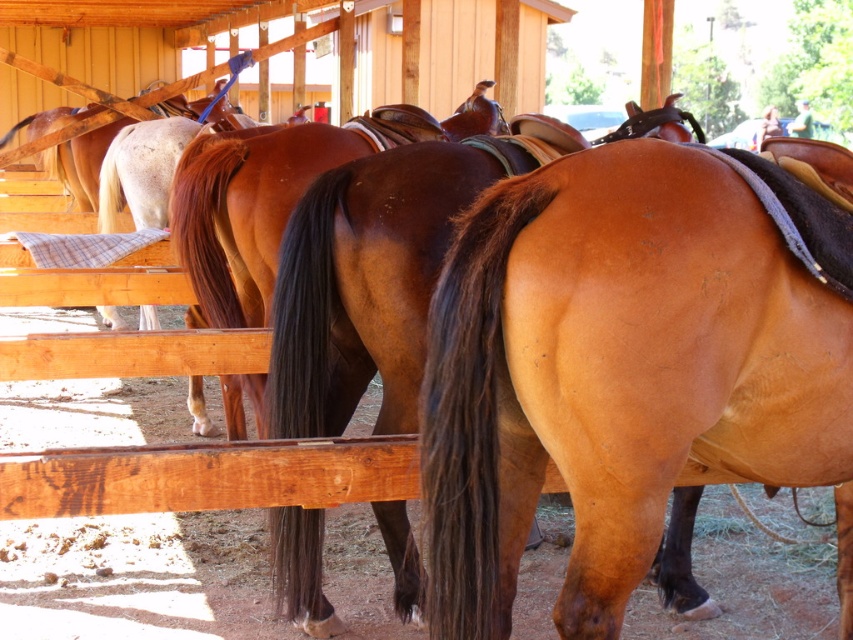
Question: Is shiny brown horse at center further to the viewer compared to brown glossy horse at center?

Choices:
 (A) no
 (B) yes

Answer: (A)

Question: Does saddle brown horse at center have a lesser width compared to shiny brown horse at center?

Choices:
 (A) no
 (B) yes

Answer: (B)

Question: Which object appears closest to the camera in this image?

Choices:
 (A) brown glossy horse at center
 (B) shiny brown horse at center

Answer: (B)

Question: Which point appears closest to the camera in this image?

Choices:
 (A) (207, 307)
 (B) (583, 234)
 (C) (392, 173)

Answer: (B)

Question: Among these points, which one is farthest from the camera?

Choices:
 (A) (711, 260)
 (B) (317, 611)

Answer: (B)

Question: Is saddle brown horse at center smaller than brown glossy horse at center?

Choices:
 (A) no
 (B) yes

Answer: (B)